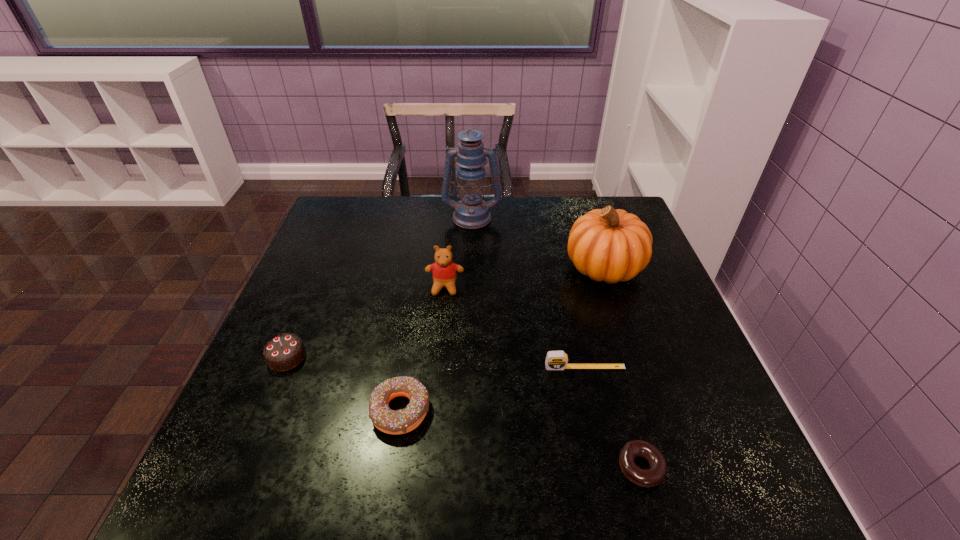
Image resolution: width=960 pixels, height=540 pixels. I want to click on vacant space at the far right corner of the desktop, so click(x=584, y=197).

Where is `free space at the near right corner of the desktop`? The image size is (960, 540). free space at the near right corner of the desktop is located at coordinates (725, 463).

Find the location of `empty location between the pumpkin and the chocolate cake`. empty location between the pumpkin and the chocolate cake is located at coordinates click(445, 312).

This screenshot has width=960, height=540. I want to click on vacant space that is in between the sixth farthest object and the fourth shortest object, so 344,384.

This screenshot has width=960, height=540. Find the location of `free space between the leftmost object and the tape measure`. free space between the leftmost object and the tape measure is located at coordinates (436, 362).

Where is `vacant area that lies between the pumpkin and the lantern`? This screenshot has height=540, width=960. vacant area that lies between the pumpkin and the lantern is located at coordinates (538, 242).

Identify the location of free space between the sixth farthest object and the second tallest object. (502, 339).

Identify the location of free space between the nearest object and the farthest object. (556, 342).

Where is `free space that is in between the pumpkin and the teddy bear`? free space that is in between the pumpkin and the teddy bear is located at coordinates (524, 277).

You are a GUI agent. You are given a task and a screenshot of the screen. Output one action in this format:
    pyautogui.click(x=<x>, y=<y>)
    Task: Click on the free spot between the fifth shortest object and the sixth shortest object
    The image size is (960, 540).
    Given the screenshot: What is the action you would take?
    pyautogui.click(x=524, y=277)